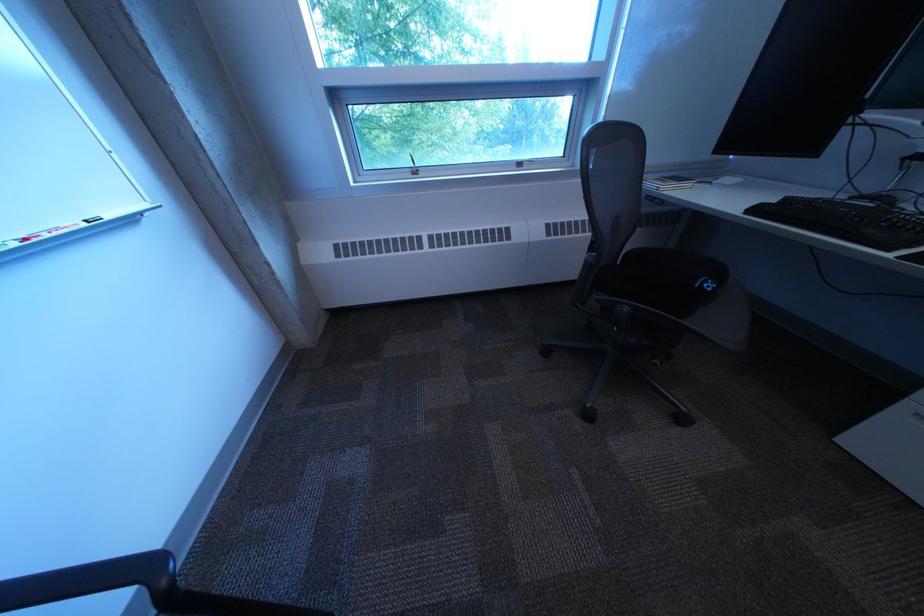
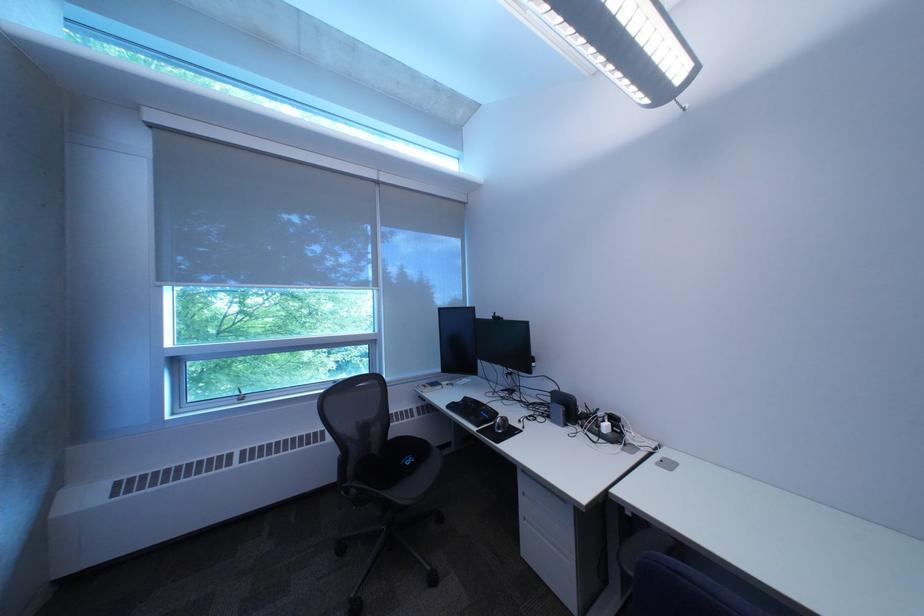
Locate, in the second image, the point that corresponds to (x=767, y=213) in the first image.

(464, 408)